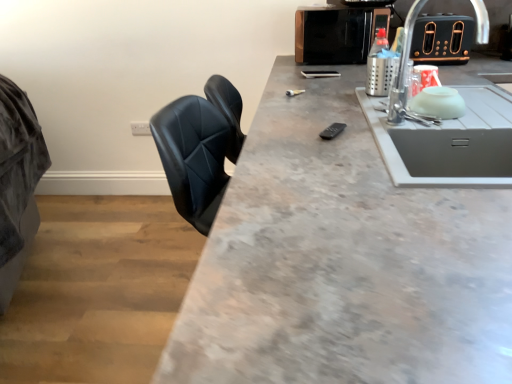
This screenshot has height=384, width=512. Describe the element at coordinates (446, 140) in the screenshot. I see `white matte sink at right` at that location.

Describe the element at coordinates (337, 33) in the screenshot. I see `metallic microwave at upper right, the 1th appliance when ordered from left to right` at that location.

What is the approximate height of gray concrete countertop at center?

gray concrete countertop at center is 91.23 centimeters tall.

Locate an element on the screen. white matte sink at right is located at coordinates (446, 140).

I want to click on appliance on the left of black metallic toaster at upper right, the second appliance in the left-to-right sequence, so click(x=337, y=33).

Is metallic microwave at upper right, which appears as the 2th appliance when viewed from the right, thinner than black metallic toaster at upper right, the second appliance in the left-to-right sequence?

Yes.

Is the surface of metallic microwave at upper right, the 1th appliance when ordered from left to right, in direct contact with black metallic toaster at upper right, the second appliance in the left-to-right sequence?

metallic microwave at upper right, the 1th appliance when ordered from left to right, and black metallic toaster at upper right, the second appliance in the left-to-right sequence, are not in contact.

Considering their positions, is white plastic electric outlet at upper center located in front of or behind metallic silver bottle at upper right?

Visually, white plastic electric outlet at upper center is located behind metallic silver bottle at upper right.

Considering the sizes of objects white plastic electric outlet at upper center and metallic silver bottle at upper right in the image provided, who is smaller, white plastic electric outlet at upper center or metallic silver bottle at upper right?

white plastic electric outlet at upper center is smaller.

Is white plastic electric outlet at upper center facing towards metallic silver bottle at upper right?

No, white plastic electric outlet at upper center does not turn towards metallic silver bottle at upper right.

Is white matte sink at right turned away from metallic silver bottle at upper right?

white matte sink at right does not have its back to metallic silver bottle at upper right.

Does white matte sink at right appear on the right side of metallic silver bottle at upper right?

Yes.

Which point is more distant from viewer, (495, 186) or (373, 68)?

The point (373, 68) is behind.

Is white matte sink at right with metallic silver bottle at upper right?

No, white matte sink at right is not next to metallic silver bottle at upper right.

Is white plastic electric outlet at upper center directly adjacent to white matte sink at right?

white plastic electric outlet at upper center is not next to white matte sink at right, and they're not touching.

From the image's perspective, is white plastic electric outlet at upper center above white matte sink at right?

Yes, from the image's perspective, white plastic electric outlet at upper center is over white matte sink at right.

Is point (131, 126) positioned after point (481, 6)?

That is True.

Is metallic silver bottle at upper right located outside white matte sink at right?

metallic silver bottle at upper right lies outside white matte sink at right's area.

Consider the image. Does metallic silver bottle at upper right have a lesser height compared to white matte sink at right?

Correct, metallic silver bottle at upper right is not as tall as white matte sink at right.

Considering the relative sizes of metallic silver bottle at upper right and white matte sink at right in the image provided, is metallic silver bottle at upper right thinner than white matte sink at right?

Yes, metallic silver bottle at upper right is thinner than white matte sink at right.

Considering the positions of objects metallic silver bottle at upper right and white matte sink at right in the image provided, who is more to the left, metallic silver bottle at upper right or white matte sink at right?

Positioned to the left is metallic silver bottle at upper right.

Is metallic microwave at upper right, the 1th appliance when ordered from left to right, positioned beyond the bounds of metallic silver bottle at upper right?

Yes.

Is metallic microwave at upper right, which appears as the 2th appliance when viewed from the right, not close to metallic silver bottle at upper right?

No, metallic microwave at upper right, which appears as the 2th appliance when viewed from the right, is not far from metallic silver bottle at upper right.

Is metallic microwave at upper right, the 1th appliance when ordered from left to right, positioned with its back to metallic silver bottle at upper right?

No.

From a real-world perspective, is metallic microwave at upper right, the 1th appliance when ordered from left to right, physically above metallic silver bottle at upper right?

Yes, from a real-world perspective, metallic microwave at upper right, the 1th appliance when ordered from left to right, is over metallic silver bottle at upper right

Is gray concrete countertop at center taller than black metallic toaster at upper right, the second appliance in the left-to-right sequence?

Yes, gray concrete countertop at center is taller than black metallic toaster at upper right, the second appliance in the left-to-right sequence.

Would you consider gray concrete countertop at center to be distant from black metallic toaster at upper right, which ranks as the 1th appliance in right-to-left order?

That's right, there is a large distance between gray concrete countertop at center and black metallic toaster at upper right, which ranks as the 1th appliance in right-to-left order.

This screenshot has width=512, height=384. Identify the location of countertop lying below the black metallic toaster at upper right, the second appliance in the left-to-right sequence (from the image's perspective). (342, 261).

What are the coordinates of `appliance above the black metallic toaster at upper right, the second appliance in the left-to-right sequence (from the image's perspective)` in the screenshot? It's located at (337, 33).

In order to click on bottle lying in front of the white plastic electric outlet at upper center in this screenshot , I will do `click(380, 66)`.

Estimate the real-world distances between objects in this image. Which object is closer to white matte sink at right, black metallic toaster at upper right, which ranks as the 1th appliance in right-to-left order, or metallic microwave at upper right, which appears as the 2th appliance when viewed from the right?

black metallic toaster at upper right, which ranks as the 1th appliance in right-to-left order.

Estimate the real-world distances between objects in this image. Which object is closer to metallic silver bottle at upper right, metallic microwave at upper right, which appears as the 2th appliance when viewed from the right, or black metallic toaster at upper right, the second appliance in the left-to-right sequence?

metallic microwave at upper right, which appears as the 2th appliance when viewed from the right, is closer to metallic silver bottle at upper right.

Looking at the image, which one is located further to white plastic electric outlet at upper center, metallic microwave at upper right, which appears as the 2th appliance when viewed from the right, or metallic silver bottle at upper right?

The object further to white plastic electric outlet at upper center is metallic silver bottle at upper right.

Which object lies further to the anchor point metallic silver bottle at upper right, white matte sink at right or gray concrete countertop at center?

The object further to metallic silver bottle at upper right is gray concrete countertop at center.

Considering their positions, is gray concrete countertop at center positioned closer to white matte sink at right than white plastic electric outlet at upper center?

gray concrete countertop at center.

Looking at the image, which one is located closer to metallic silver bottle at upper right, white plastic electric outlet at upper center or black metallic toaster at upper right, the second appliance in the left-to-right sequence?

black metallic toaster at upper right, the second appliance in the left-to-right sequence, is positioned closer to the anchor metallic silver bottle at upper right.

Which object lies further to the anchor point metallic microwave at upper right, which appears as the 2th appliance when viewed from the right, metallic silver bottle at upper right or black metallic toaster at upper right, which ranks as the 1th appliance in right-to-left order?

black metallic toaster at upper right, which ranks as the 1th appliance in right-to-left order.

Based on their spatial positions, is metallic silver bottle at upper right or black metallic toaster at upper right, the second appliance in the left-to-right sequence, closer to white matte sink at right?

metallic silver bottle at upper right.

Locate an element on the screen. bottle between gray concrete countertop at center and white plastic electric outlet at upper center along the z-axis is located at coordinates (380, 66).

This screenshot has height=384, width=512. I want to click on sink between gray concrete countertop at center and metallic microwave at upper right, which appears as the 2th appliance when viewed from the right, along the z-axis, so click(446, 140).

You are a GUI agent. You are given a task and a screenshot of the screen. Output one action in this format:
    pyautogui.click(x=<x>, y=<y>)
    Task: Click on the bottle between white plastic electric outlet at upper center and black metallic toaster at upper right, which ranks as the 1th appliance in right-to-left order, from left to right
    The width and height of the screenshot is (512, 384).
    Given the screenshot: What is the action you would take?
    pyautogui.click(x=380, y=66)

Image resolution: width=512 pixels, height=384 pixels. I want to click on bottle between gray concrete countertop at center and metallic microwave at upper right, which appears as the 2th appliance when viewed from the right, along the z-axis, so click(380, 66).